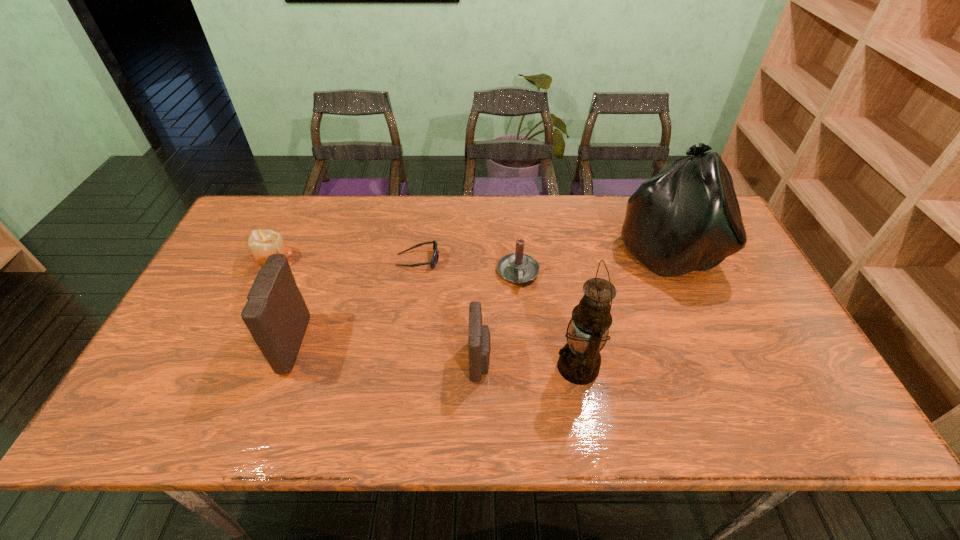
Find the location of a particular element. Image resolution: width=960 pixels, height=540 pixels. oil lamp at the near edge is located at coordinates (579, 362).

Find the location of a particular element. object present at the left edge is located at coordinates (262, 242).

At what (x,y) coordinates should I click in order to perform the action: click on object at the right edge. Please return your answer as a coordinate pair (x, y). This screenshot has width=960, height=540. Looking at the image, I should click on (686, 218).

Find the location of a particular element. The image size is (960, 540). object at the far right corner is located at coordinates (686, 218).

Image resolution: width=960 pixels, height=540 pixels. Find the location of `blank space at the far edge`. blank space at the far edge is located at coordinates (536, 240).

At what (x,y) coordinates should I click in order to perform the action: click on vacant space at the near edge. Please return your answer as a coordinate pair (x, y). The image size is (960, 540). Looking at the image, I should click on (445, 374).

Where is `vacant space at the left edge`? The image size is (960, 540). vacant space at the left edge is located at coordinates (223, 350).

In the image, there is a desktop. Where is `free space at the right edge`? free space at the right edge is located at coordinates (752, 354).

Where is `free space at the near right corner of the desktop`? The height and width of the screenshot is (540, 960). free space at the near right corner of the desktop is located at coordinates (772, 374).

Where is `free space between the leftmost object and the plastic bag`? free space between the leftmost object and the plastic bag is located at coordinates (470, 255).